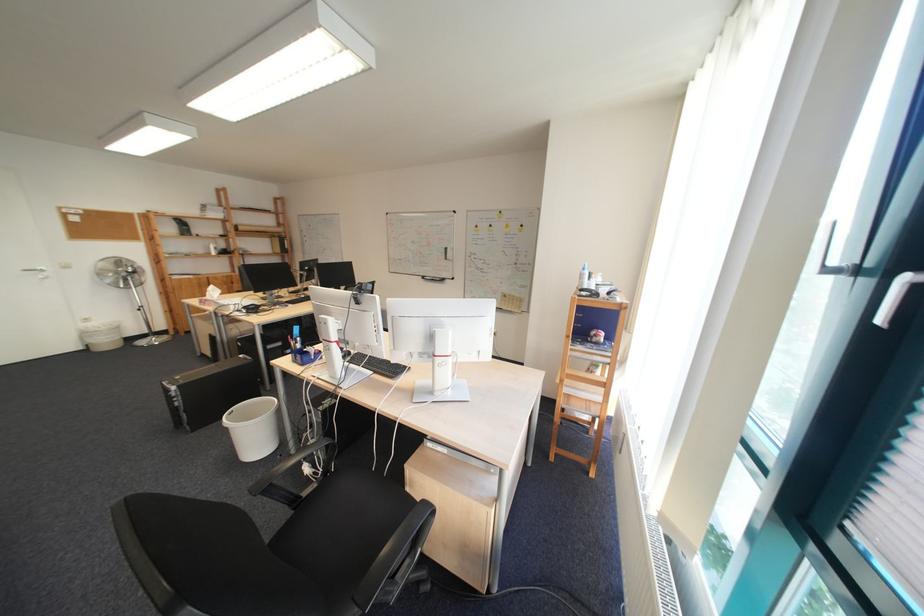
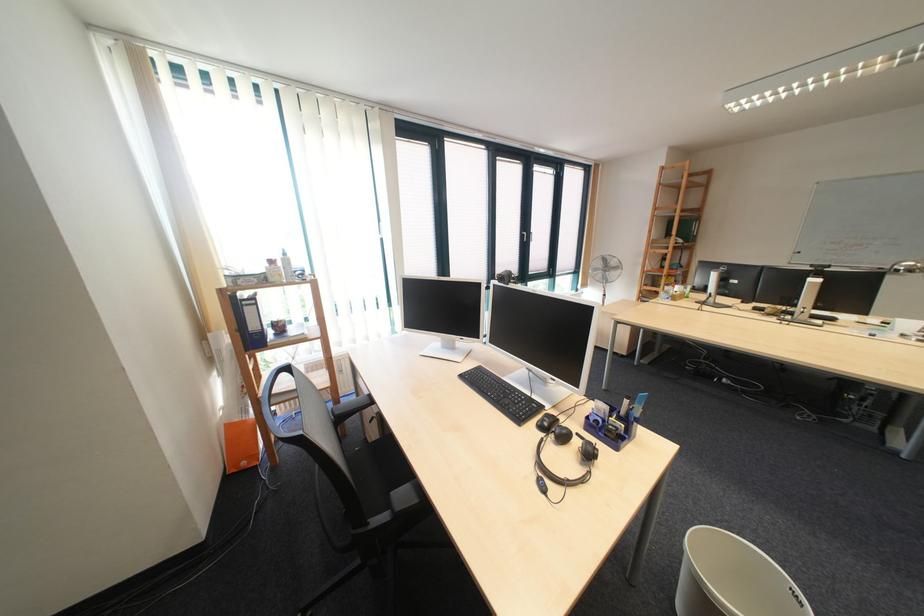
Question: I am providing you with two images of the same scene from different viewpoints. Which of the following objects are not visible in image2?

Choices:
 (A) black square box
 (B) black chair armrest
 (C) blue desk organizer
 (D) black computer mouse

Answer: (B)